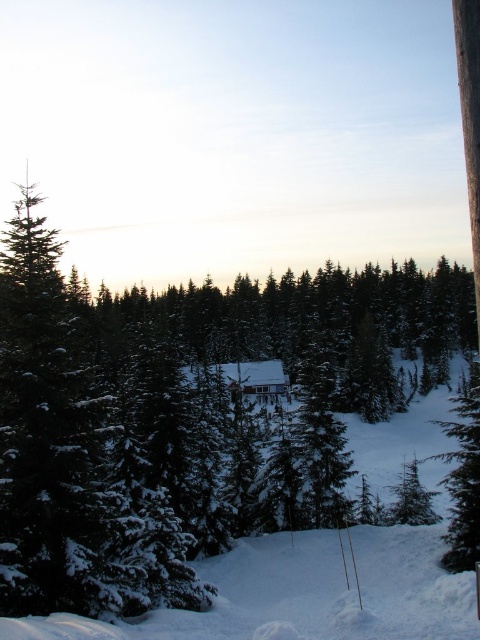
Question: Which of the following is the farthest from the observer?

Choices:
 (A) white snow ski slope at lower center
 (B) wooden cabin at center

Answer: (B)

Question: Which point is closer to the camera?

Choices:
 (A) (163, 611)
 (B) (251, 394)

Answer: (A)

Question: Is the position of white snow ski slope at lower center less distant than that of wooden cabin at center?

Choices:
 (A) no
 (B) yes

Answer: (B)

Question: Observing the image, what is the correct spatial positioning of white snow ski slope at lower center in reference to wooden cabin at center?

Choices:
 (A) left
 (B) right

Answer: (B)

Question: Which of the following is the closest to the observer?

Choices:
 (A) wooden cabin at center
 (B) white snow ski slope at lower center

Answer: (B)

Question: Can you confirm if white snow ski slope at lower center is positioned above wooden cabin at center?

Choices:
 (A) yes
 (B) no

Answer: (A)